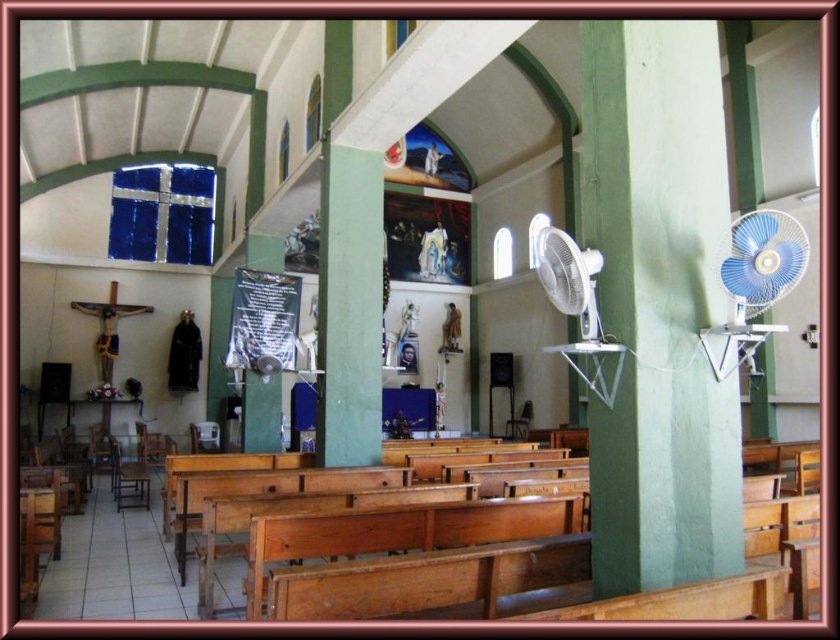
Which is behind, point (324, 417) or point (525, 403)?

Point (525, 403)

What do you see at coordinates (349, 307) in the screenshot? The width and height of the screenshot is (840, 640). I see `green smooth pillar at center` at bounding box center [349, 307].

You are a GUI agent. You are given a task and a screenshot of the screen. Output one action in this format:
    pyautogui.click(x=<x>, y=<y>)
    Task: Click on the green smooth pillar at center
    
    Given the screenshot: What is the action you would take?
    pyautogui.click(x=349, y=307)

This screenshot has width=840, height=640. Find the location of `wooden bench at center`. wooden bench at center is located at coordinates (428, 561).

Which is more to the right, wooden bench at center or brown wooden chair at lower left?

Positioned to the right is wooden bench at center.

This screenshot has height=640, width=840. In order to click on wooden bench at center in this screenshot , I will do `click(428, 561)`.

Between blue plastic fan at right and wooden at center, which one has less height?

Standing shorter between the two is blue plastic fan at right.

Does blue plastic fan at right come in front of wooden at center?

That is True.

Is point (764, 252) closer to camera compared to point (518, 419)?

Yes, point (764, 252) is closer to viewer.

Where is `blue plastic fan at right`? This screenshot has height=640, width=840. blue plastic fan at right is located at coordinates (762, 260).